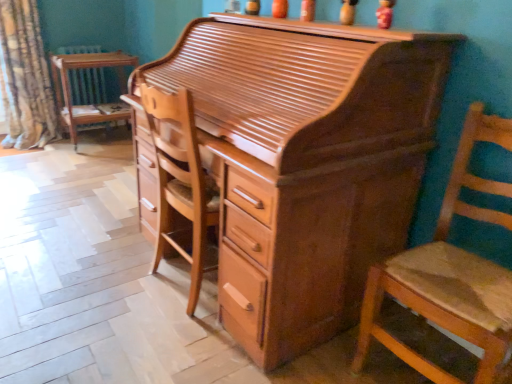
Question: Can you confirm if wooden chair at right is wider than wooden chair at left?

Choices:
 (A) no
 (B) yes

Answer: (B)

Question: Does wooden chair at right have a lesser width compared to wooden chair at left?

Choices:
 (A) yes
 (B) no

Answer: (B)

Question: Is the depth of wooden chair at right greater than that of wooden chair at left?

Choices:
 (A) yes
 (B) no

Answer: (B)

Question: Can you confirm if wooden chair at right is bigger than wooden chair at left?

Choices:
 (A) no
 (B) yes

Answer: (B)

Question: Does wooden chair at right have a lesser height compared to wooden chair at left?

Choices:
 (A) yes
 (B) no

Answer: (B)

Question: Choose the correct answer: Is wooden chair at right inside shiny brown wood desk at center or outside it?

Choices:
 (A) inside
 (B) outside

Answer: (B)

Question: Does point (455, 205) appear closer or farther from the camera than point (344, 145)?

Choices:
 (A) closer
 (B) farther

Answer: (B)

Question: Based on their positions, is wooden chair at right located to the left or right of shiny brown wood desk at center?

Choices:
 (A) right
 (B) left

Answer: (A)

Question: From the image's perspective, relative to shiny brown wood desk at center, is wooden chair at right above or below?

Choices:
 (A) below
 (B) above

Answer: (A)

Question: Do you think wooden radiator at left is within shiny brown wood desk at center, or outside of it?

Choices:
 (A) outside
 (B) inside

Answer: (A)

Question: Considering the positions of point (94, 81) and point (300, 321), is point (94, 81) closer or farther from the camera than point (300, 321)?

Choices:
 (A) closer
 (B) farther

Answer: (B)

Question: From the image's perspective, relative to shiny brown wood desk at center, is wooden radiator at left above or below?

Choices:
 (A) above
 (B) below

Answer: (A)

Question: Considering the positions of wooden radiator at left and shiny brown wood desk at center in the image, is wooden radiator at left bigger or smaller than shiny brown wood desk at center?

Choices:
 (A) big
 (B) small

Answer: (B)

Question: Which is correct: patterned fabric curtain at left is inside wooden chair at left, or outside of it?

Choices:
 (A) inside
 (B) outside

Answer: (B)

Question: Does point (15, 29) appear closer or farther from the camera than point (87, 109)?

Choices:
 (A) closer
 (B) farther

Answer: (A)